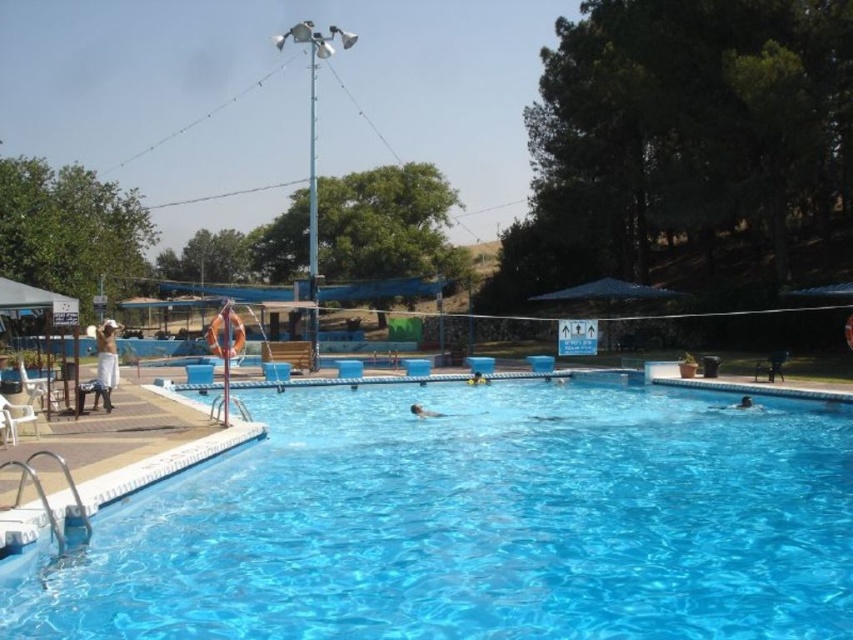
Question: Which object appears closest to the camera in this image?

Choices:
 (A) smooth skin person at center
 (B) smooth blue swimmer at center

Answer: (A)

Question: Which point appears farthest from the camera in this image?

Choices:
 (A) (468, 582)
 (B) (483, 384)
 (C) (421, 406)
 (D) (102, 348)

Answer: (B)

Question: Does transparent blue water at center come in front of smooth skin person at center?

Choices:
 (A) no
 (B) yes

Answer: (B)

Question: From the image, what is the correct spatial relationship of smooth skin person at center in relation to smooth blue swimmer at center?

Choices:
 (A) above
 (B) below

Answer: (B)

Question: Which of the following is the closest to the observer?

Choices:
 (A) transparent blue water at center
 (B) smooth blue swimmer at center

Answer: (A)

Question: Is smooth skin person at center positioned before smooth blue swimmer at center?

Choices:
 (A) no
 (B) yes

Answer: (B)